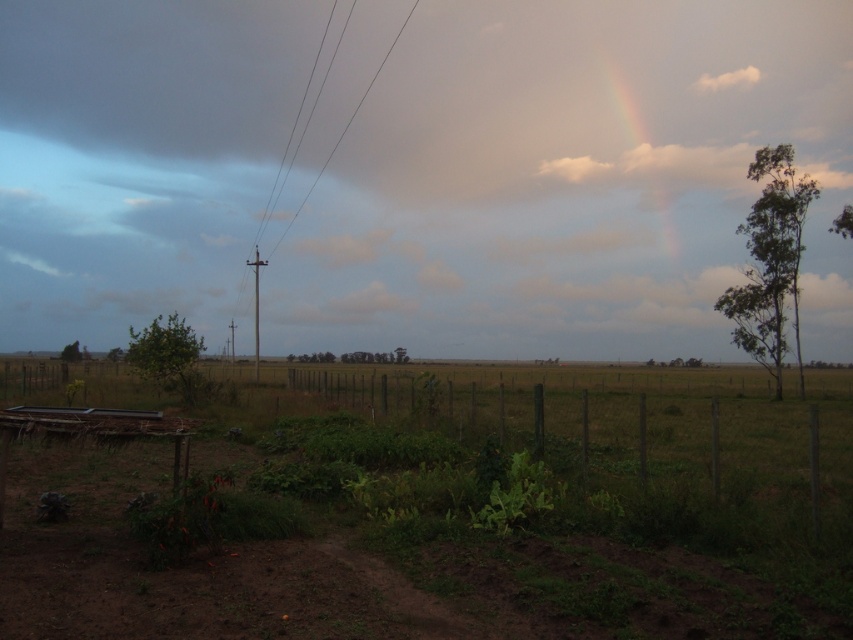
Which of these two, green wire fence at center or white fluffy cloud at upper right, stands shorter?

green wire fence at center

Which is more to the left, green wire fence at center or white fluffy cloud at upper right?

green wire fence at center is more to the left.

Locate an element on the screen. The image size is (853, 640). green wire fence at center is located at coordinates (666, 436).

Does smooth wire at center have a smaller size compared to white fluffy cloud at upper right?

No.

Between smooth wire at center and white fluffy cloud at upper right, which one appears on the left side from the viewer's perspective?

smooth wire at center is more to the left.

Where is `smooth wire at center`? The width and height of the screenshot is (853, 640). smooth wire at center is located at coordinates (346, 125).

What are the coordinates of `smooth wire at center` in the screenshot? It's located at (346, 125).

Does green wire fence at center have a greater width compared to rainbow at upper right?

Yes, green wire fence at center is wider than rainbow at upper right.

This screenshot has width=853, height=640. What do you see at coordinates (666, 436) in the screenshot?
I see `green wire fence at center` at bounding box center [666, 436].

Locate an element on the screen. The height and width of the screenshot is (640, 853). green wire fence at center is located at coordinates (666, 436).